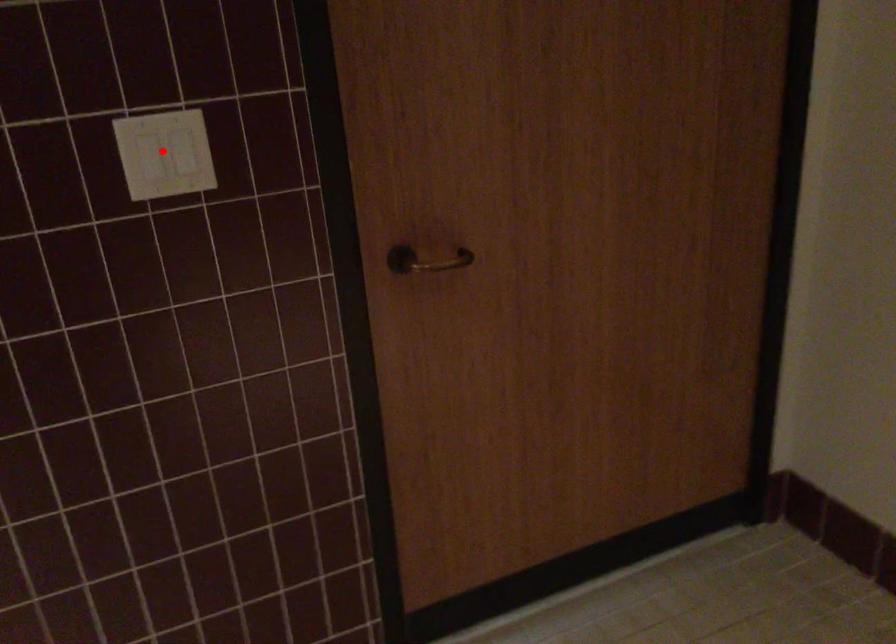
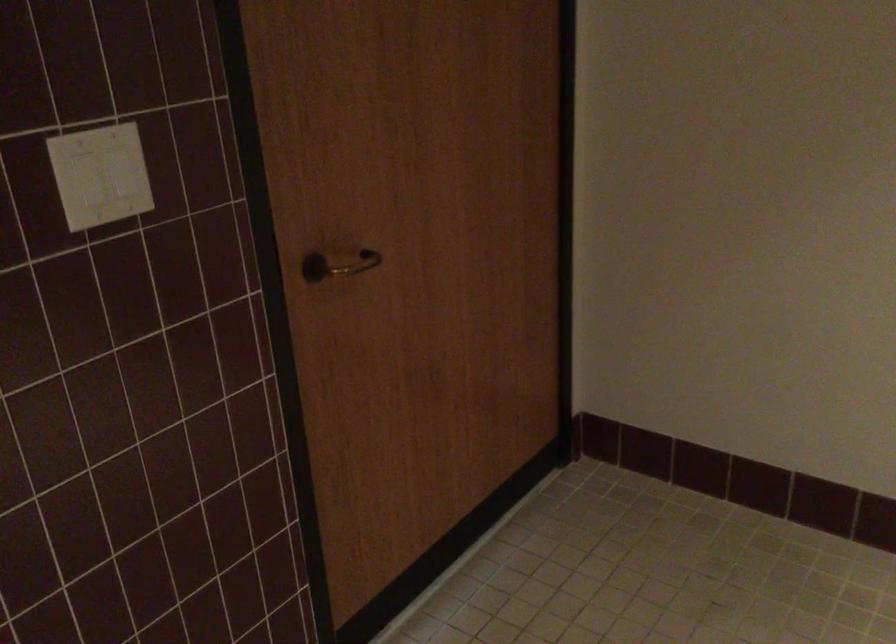
Question: I am providing you with two images of the same scene from different viewpoints. Image1 has a red point marked. In image2, the corresponding 3D location appears at what relative position? Reply with the corresponding letter.

Choices:
 (A) Closer
 (B) Farther

Answer: (A)